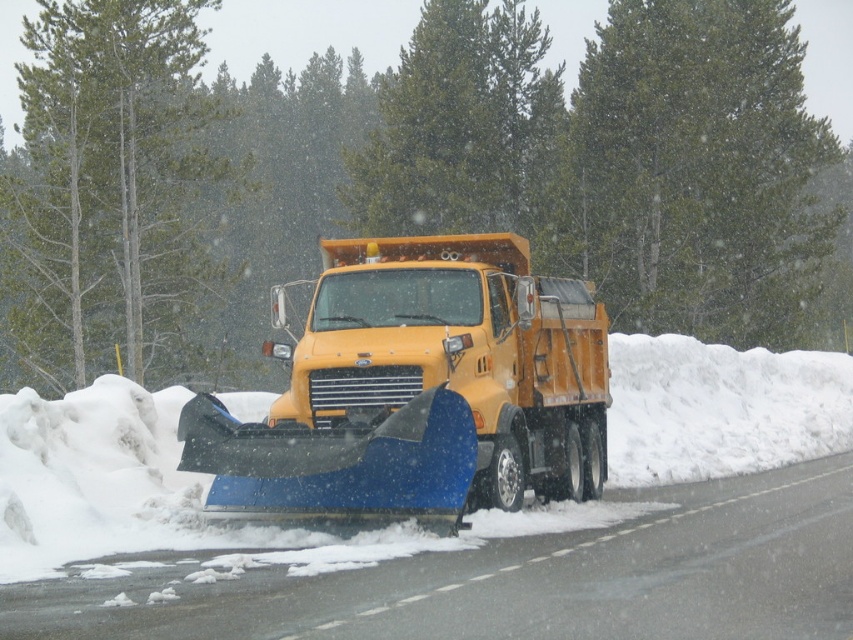
Question: Is yellow matte truck at center further to the viewer compared to green textured tree at center?

Choices:
 (A) yes
 (B) no

Answer: (B)

Question: Which object is farther from the camera taking this photo?

Choices:
 (A) green textured tree at center
 (B) green textured tree at upper center
 (C) yellow matte truck at center

Answer: (B)

Question: Is green textured tree at upper center smaller than green textured tree at center?

Choices:
 (A) no
 (B) yes

Answer: (B)

Question: Can you confirm if yellow matte truck at center is wider than green textured tree at upper center?

Choices:
 (A) yes
 (B) no

Answer: (B)

Question: Considering the real-world distances, which object is closest to the green textured tree at upper center?

Choices:
 (A) green leafy tree at upper center
 (B) yellow matte truck at center
 (C) green textured tree at center

Answer: (A)

Question: Among these objects, which one is farthest from the camera?

Choices:
 (A) green textured tree at upper center
 (B) green leafy tree at upper center
 (C) yellow matte truck at center
 (D) green textured tree at center

Answer: (A)